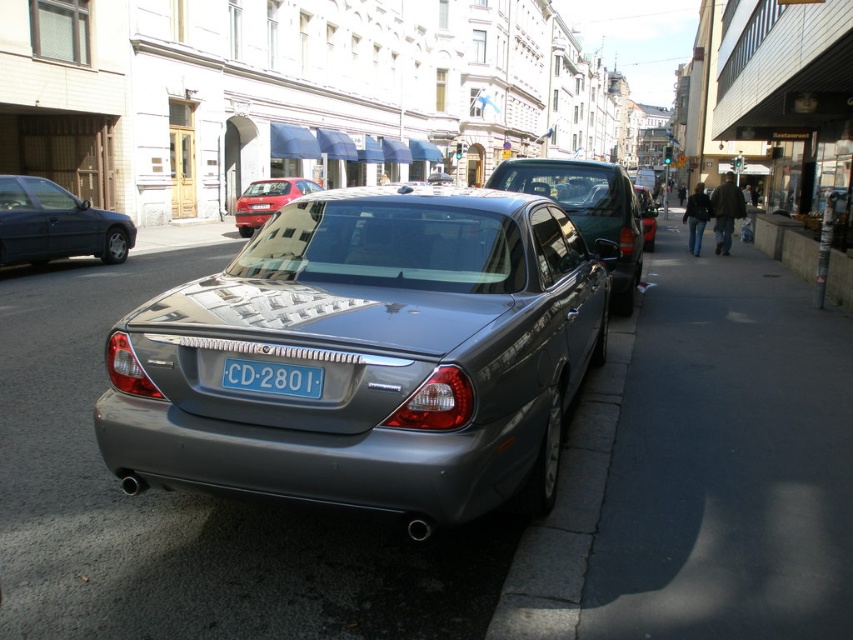
Looking at this image, is satin silver sedan at center wider than matte black sedan at left?

Yes, satin silver sedan at center is wider than matte black sedan at left.

Does satin silver sedan at center appear on the right side of matte black sedan at left?

Yes, satin silver sedan at center is to the right of matte black sedan at left.

Describe the element at coordinates (587, 211) in the screenshot. I see `satin silver sedan at center` at that location.

Locate an element on the screen. The width and height of the screenshot is (853, 640). satin silver sedan at center is located at coordinates (587, 211).

In the scene shown: Does satin metallic sedan at center have a smaller size compared to gray concrete curb at lower right?

No.

Can you confirm if satin metallic sedan at center is thinner than gray concrete curb at lower right?

In fact, satin metallic sedan at center might be wider than gray concrete curb at lower right.

Between point (416, 422) and point (548, 627), which one is positioned in front?

Point (548, 627)

The width and height of the screenshot is (853, 640). Identify the location of satin metallic sedan at center. (369, 356).

Measure the distance between point (193, 419) and camera.

The distance of point (193, 419) from camera is 2.70 meters.

At what (x,y) coordinates should I click in order to perform the action: click on satin metallic sedan at center. Please return your answer as a coordinate pair (x, y). Looking at the image, I should click on (369, 356).